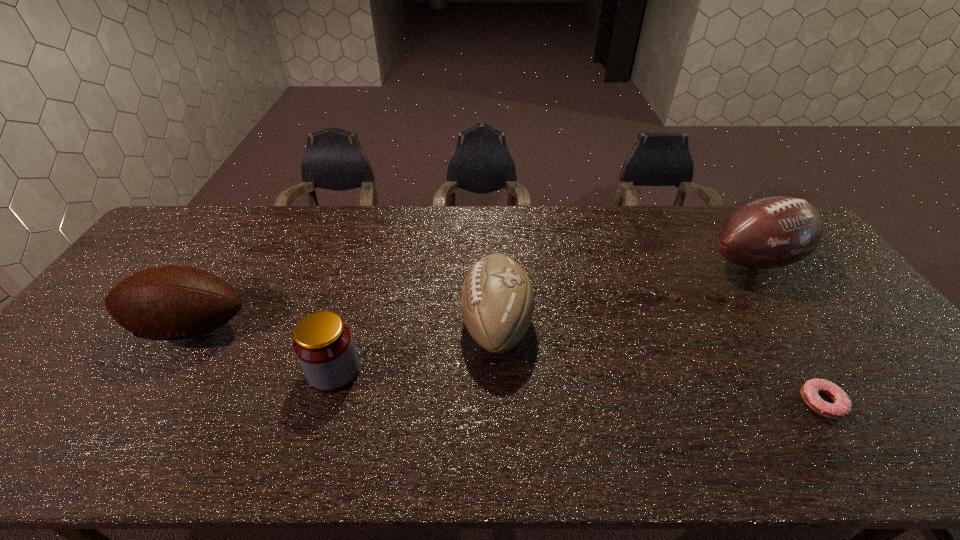
Select which object appears as the closest to the rightmost football (American). Please provide its 2D coordinates. Your answer should be formatted as a tuple, i.e. [(x, y)], where the tuple contains the x and y coordinates of a point satisfying the conditions above.

[(841, 407)]

What are the coordinates of `the third closest object relative to the second shortest object` in the screenshot? It's located at (772, 232).

Locate an element on the screen. The height and width of the screenshot is (540, 960). football (American) that is the closest to the fourth tallest object is located at coordinates (168, 302).

The image size is (960, 540). In order to click on football (American) that can be found as the second closest to the leftmost object in this screenshot , I will do `click(772, 232)`.

This screenshot has width=960, height=540. I want to click on vacant space that satisfies the following two spatial constraints: 1. on the laces of the shortest object; 2. on the right side of the second football (American) from left to right, so click(x=499, y=403).

Where is `free point that satisfies the following two spatial constraints: 1. on the laces of the third object from left to right; 2. on the laces of the leftmost football (American)`? This screenshot has width=960, height=540. free point that satisfies the following two spatial constraints: 1. on the laces of the third object from left to right; 2. on the laces of the leftmost football (American) is located at coordinates (496, 328).

Image resolution: width=960 pixels, height=540 pixels. Identify the location of free space in the image that satisfies the following two spatial constraints: 1. on the laces of the second football (American) from left to right; 2. on the right side of the shortest object. (499, 403).

Locate an element on the screen. vacant space that satisfies the following two spatial constraints: 1. on the back side of the doughnut; 2. on the laces of the third object from right to left is located at coordinates (772, 325).